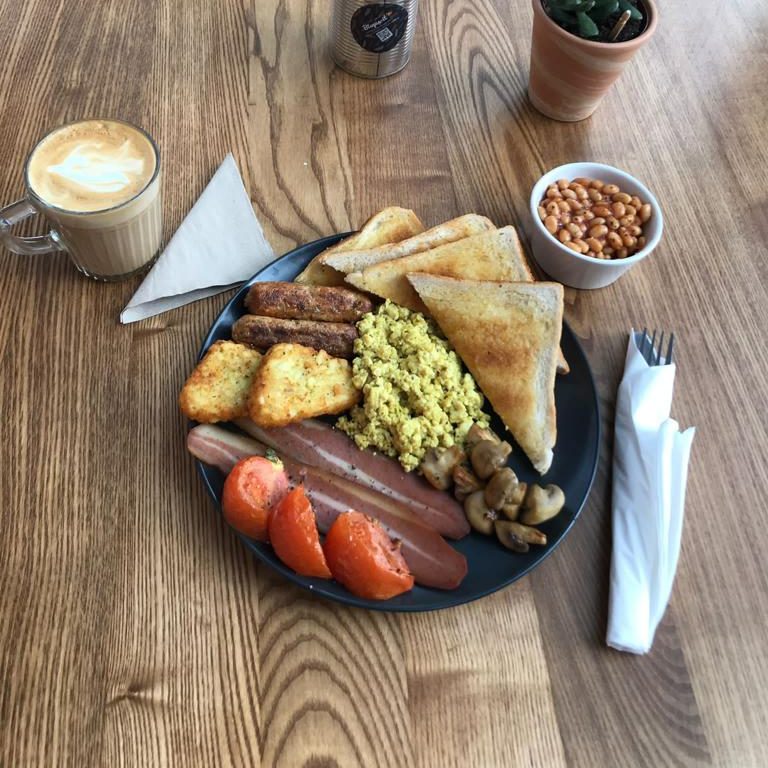
Locate an element on the screen. The image size is (768, 768). wooden table is located at coordinates (452, 124).